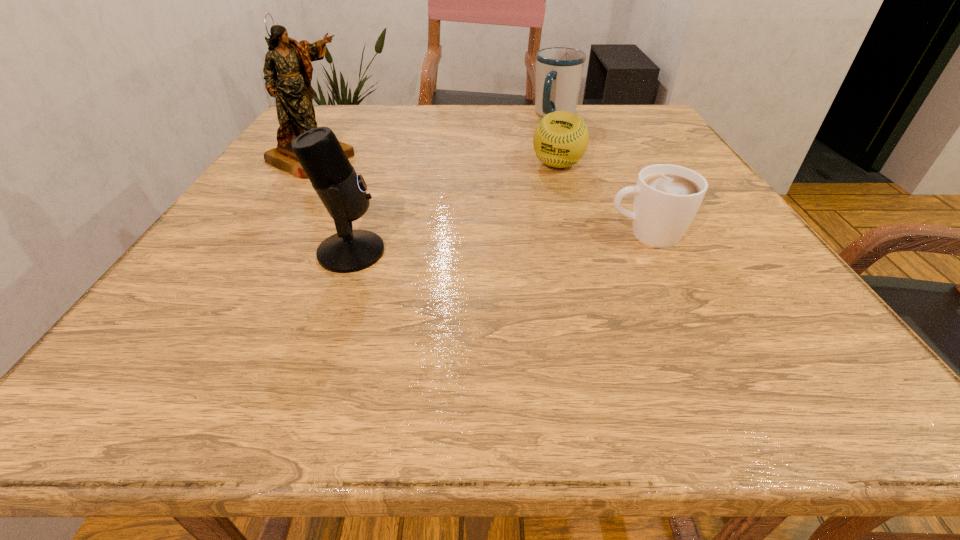
Where is `object that stands as the closest to the softball`? object that stands as the closest to the softball is located at coordinates (559, 70).

At what (x,y) coordinates should I click in order to perform the action: click on free space that satisfies the following two spatial constraints: 1. on the front side of the second tallest object; 2. on the stand of the figurine. Please return your answer as a coordinate pair (x, y). Looking at the image, I should click on (251, 252).

Locate an element on the screen. Image resolution: width=960 pixels, height=540 pixels. vacant space that satisfies the following two spatial constraints: 1. on the front side of the softball; 2. with the handle on the side of the cappuccino is located at coordinates (577, 234).

Locate an element on the screen. The width and height of the screenshot is (960, 540). free location that satisfies the following two spatial constraints: 1. on the front side of the softball; 2. with the handle on the side of the cappuccino is located at coordinates (577, 234).

This screenshot has width=960, height=540. I want to click on vacant area in the image that satisfies the following two spatial constraints: 1. on the front side of the tallest object; 2. on the stand of the microphone, so click(x=251, y=252).

This screenshot has width=960, height=540. I want to click on vacant space that satisfies the following two spatial constraints: 1. on the front side of the tallest object; 2. on the left side of the softball, so click(306, 165).